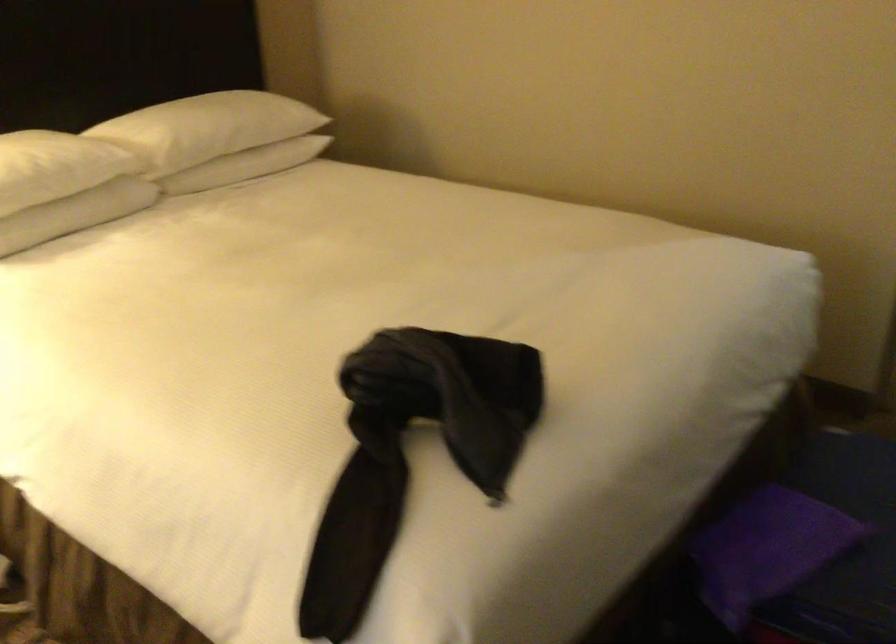
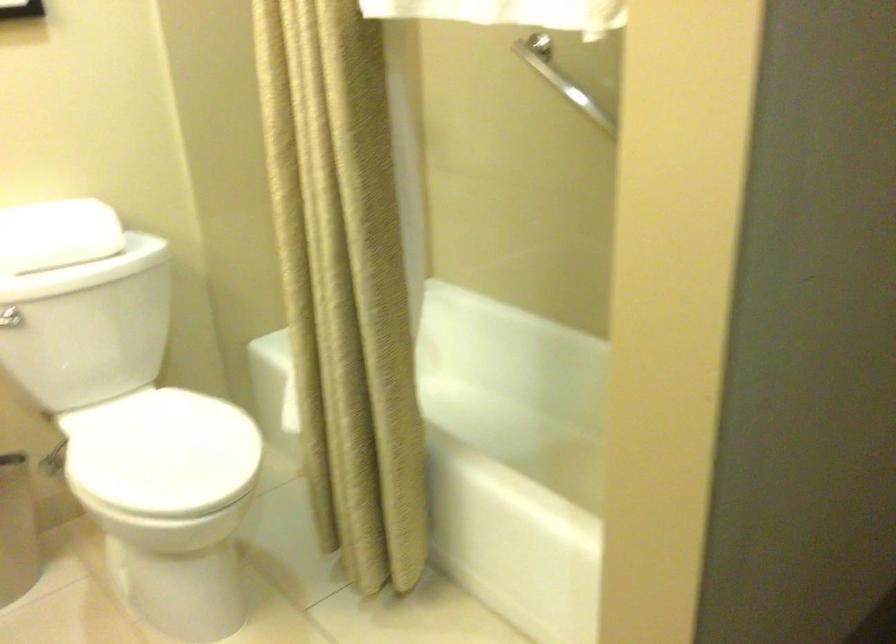
The images are taken continuously from a first-person perspective. In which direction are you moving?

The movement direction of the cameraman is right, forward.